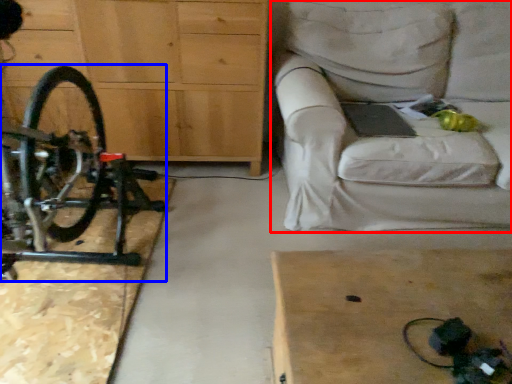
Question: Which of the following is the farthest to the observer, studio couch (highlighted by a red box) or bicycle (highlighted by a blue box)?

Choices:
 (A) studio couch
 (B) bicycle

Answer: (A)